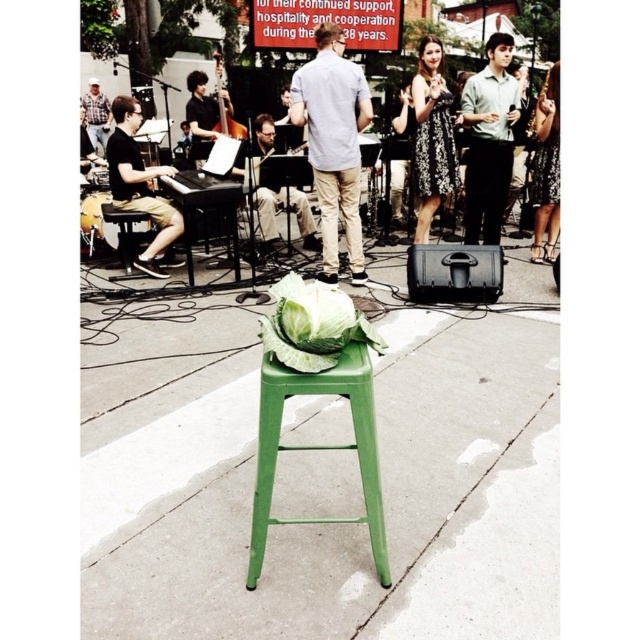
Does green metal stool at center have a lesser width compared to green metal bar stool at left?

In fact, green metal stool at center might be wider than green metal bar stool at left.

Is green metal stool at center positioned at the back of green metal bar stool at left?

No.

Is point (109, 620) less distant than point (138, 214)?

That is True.

Locate an element on the screen. This screenshot has width=640, height=640. green metal stool at center is located at coordinates (323, 525).

Is matte black shirt at center above plaid shirt at left?

No, matte black shirt at center is not above plaid shirt at left.

Does matte black shirt at center have a larger size compared to plaid shirt at left?

Indeed, matte black shirt at center has a larger size compared to plaid shirt at left.

Does point (273, 122) come farther from viewer compared to point (104, 132)?

No, (273, 122) is closer to viewer.

I want to click on matte black shirt at center, so click(273, 192).

Between point (314, 138) and point (156, 243), which one is positioned behind?

Positioned behind is point (156, 243).

What do you see at coordinates (333, 144) in the screenshot? This screenshot has width=640, height=640. I see `light blue shirt at center` at bounding box center [333, 144].

Does point (355, 244) lie in front of point (131, 154)?

Yes, it is in front of point (131, 154).

At what (x,y) coordinates should I click in order to perform the action: click on light blue shirt at center. Please return your answer as a coordinate pair (x, y). Looking at the image, I should click on (333, 144).